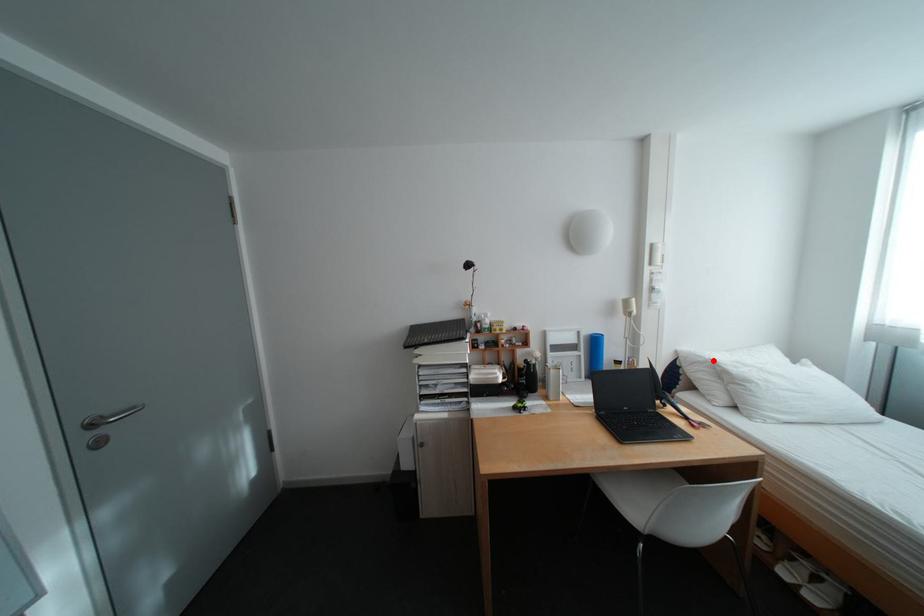
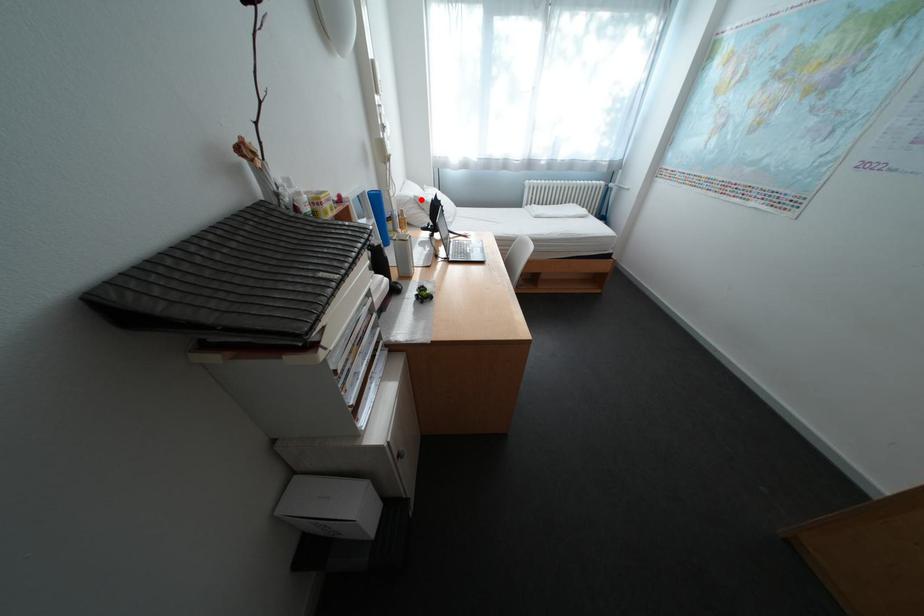
I am providing you with two images of the same scene from different viewpoints. A red point is marked on the first image and another point is marked on the second image. Is the marked point in image1 the same physical position as the marked point in image2?

Yes